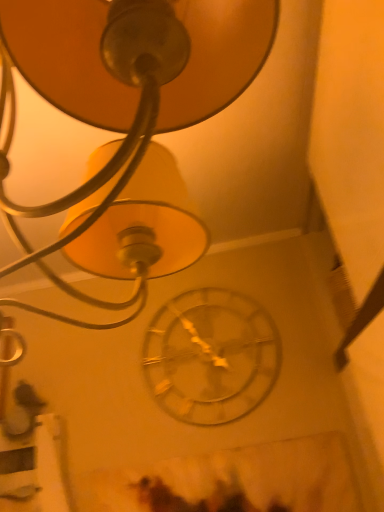
Question: Would you say metallic silver clock at center is to the left or to the right of metallic gold lampshade at upper center in the picture?

Choices:
 (A) left
 (B) right

Answer: (B)

Question: In terms of height, does metallic silver clock at center look taller or shorter compared to metallic gold lampshade at upper center?

Choices:
 (A) short
 (B) tall

Answer: (A)

Question: From the image's perspective, relative to metallic gold lampshade at upper center, is metallic silver clock at center above or below?

Choices:
 (A) above
 (B) below

Answer: (B)

Question: In the image, is metallic gold lampshade at upper center positioned in front of or behind metallic silver clock at center?

Choices:
 (A) behind
 (B) front

Answer: (B)

Question: Considering the positions of metallic gold lampshade at upper center and metallic silver clock at center in the image, is metallic gold lampshade at upper center wider or thinner than metallic silver clock at center?

Choices:
 (A) wide
 (B) thin

Answer: (A)

Question: Considering the positions of metallic gold lampshade at upper center and metallic silver clock at center in the image, is metallic gold lampshade at upper center taller or shorter than metallic silver clock at center?

Choices:
 (A) short
 (B) tall

Answer: (B)

Question: Would you say metallic gold lampshade at upper center is to the left or to the right of metallic silver clock at center in the picture?

Choices:
 (A) right
 (B) left

Answer: (B)